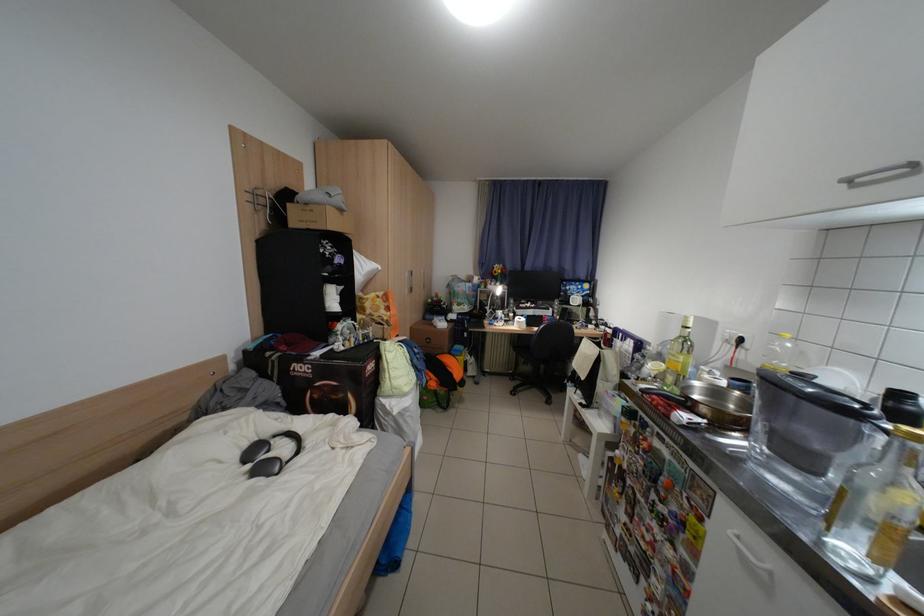
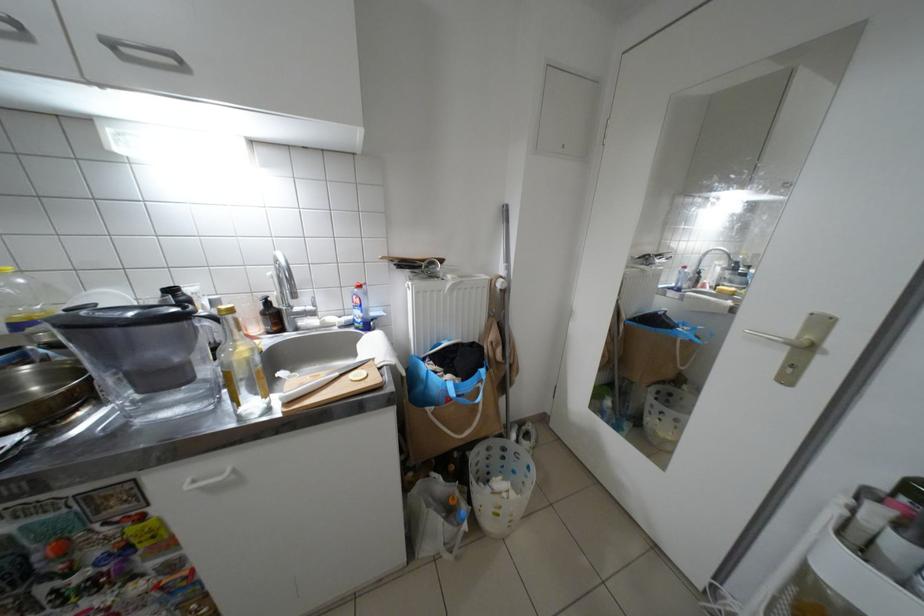
Locate, in the second image, the point that corresponds to point 749,538 in the first image.

(205, 483)